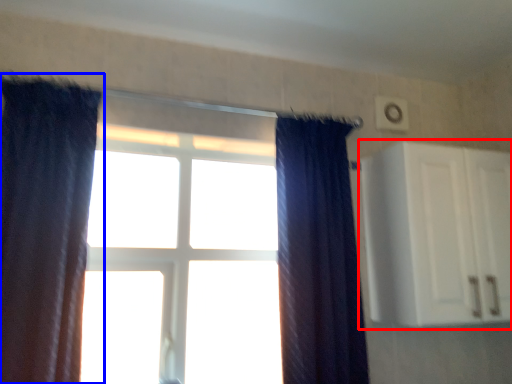
Question: Which point is closer to the camera, cabinetry (highlighted by a red box) or curtain (highlighted by a blue box)?

Choices:
 (A) cabinetry
 (B) curtain

Answer: (B)